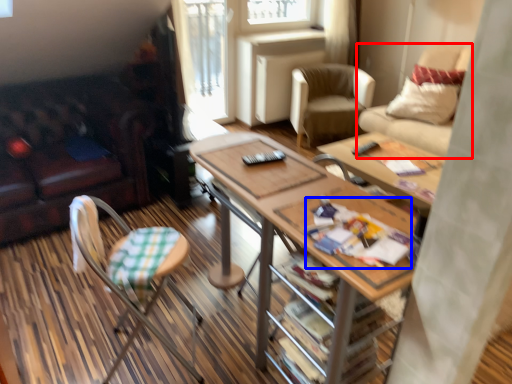
Question: Which object appears farthest to the camera in this image, chair (highlighted by a red box) or magazine (highlighted by a blue box)?

Choices:
 (A) chair
 (B) magazine

Answer: (A)